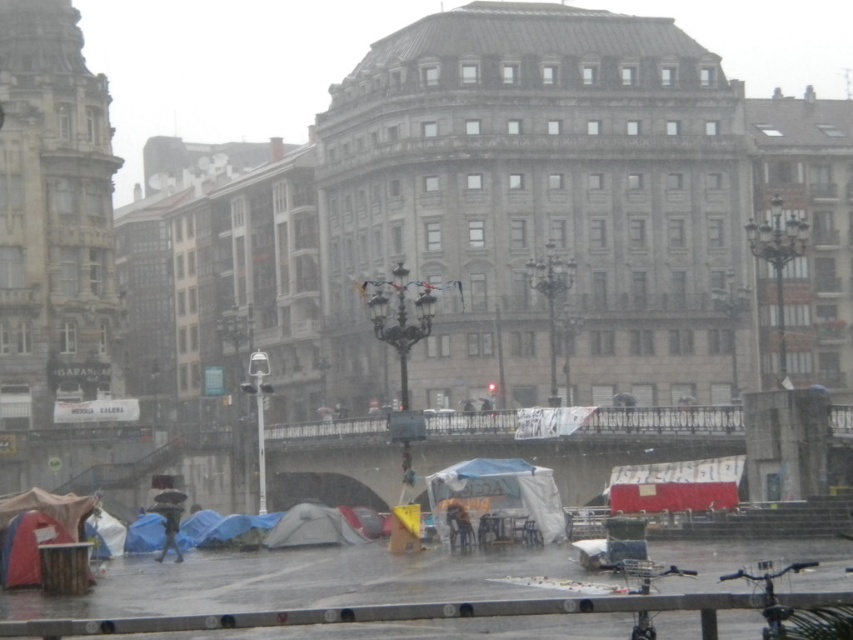
Between point (476, 472) and point (126, 552), which one is positioned behind?

Point (126, 552)

Between point (436, 520) and point (148, 550), which one is positioned in front?

Point (436, 520) is in front.

Locate an element on the screen. white canvas tent at center is located at coordinates (498, 493).

Find the location of a particular element. The width and height of the screenshot is (853, 640). white canvas tent at center is located at coordinates pyautogui.click(x=498, y=493).

From the picture: Is gray fabric tent at lower center bigger than blue tarp at lower left?

No.

Is point (339, 538) positioned after point (148, 516)?

No, (339, 538) is in front of (148, 516).

Find the location of a particular element. The image size is (853, 640). gray fabric tent at lower center is located at coordinates (312, 528).

Identify the location of gray fabric tent at lower center. (312, 528).

Measure the distance between point (531, 468) and camera.

They are 232.98 feet apart.

Does white canvas tent at center come behind gray fabric tent at lower center?

Result: No, it is in front of gray fabric tent at lower center.

What do you see at coordinates (498, 493) in the screenshot?
I see `white canvas tent at center` at bounding box center [498, 493].

Identify the location of white canvas tent at center. The height and width of the screenshot is (640, 853). (498, 493).